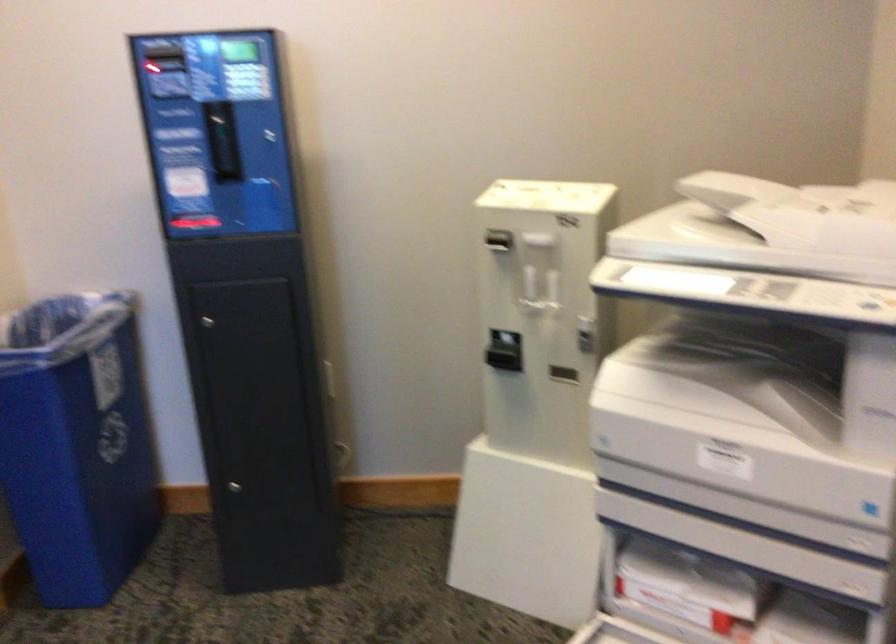
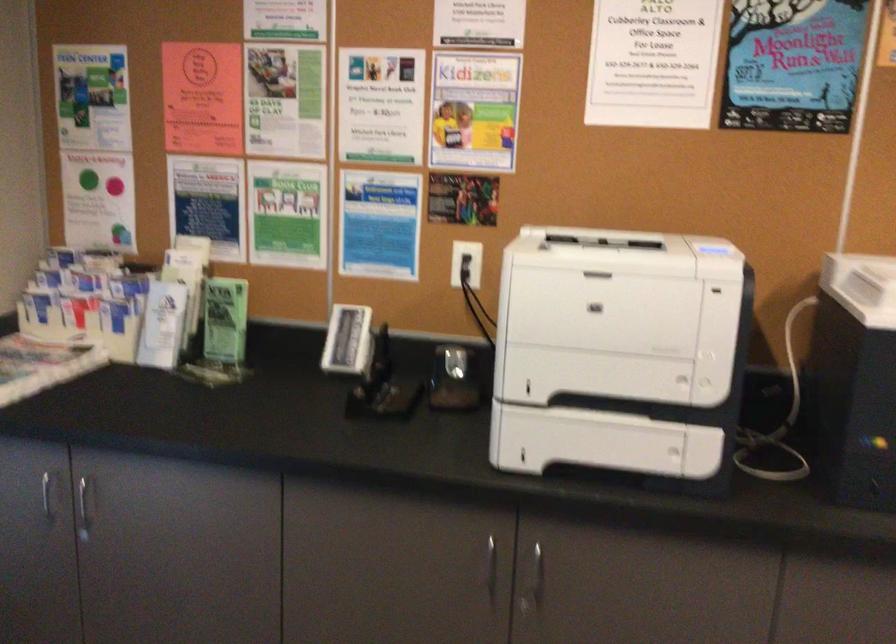
How did the camera likely rotate?

The camera rotated toward left-down.